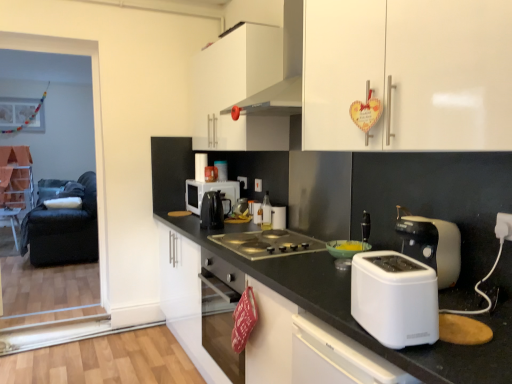
Question: From a real-world perspective, is metallic gray cooktop at center physically located above or below white glossy countertop at center?

Choices:
 (A) above
 (B) below

Answer: (A)

Question: Is metallic gray cooktop at center taller or shorter than white glossy countertop at center?

Choices:
 (A) tall
 (B) short

Answer: (B)

Question: Which object is positioned closest to the black plastic microwave at center?

Choices:
 (A) black fabric armchair at left
 (B) white glossy range hood at upper center
 (C) white glossy cabinet at upper center, which is counted as the first cabinetry, starting from the left
 (D) black plastic tea pot at center
 (E) wooden table at left

Answer: (D)

Question: Based on their relative distances, which object is nearer to the black plastic microwave at center?

Choices:
 (A) white glossy cabinet at upper center, the 2th cabinetry from the right
 (B) metallic silver kettle at center, which is the fifth appliance from front to back
 (C) metallic silver kettle at center, which is the second appliance in back-to-front order
 (D) wooden table at left
 (E) white glossy cup at center, the 3th appliance when ordered from front to back

Answer: (B)